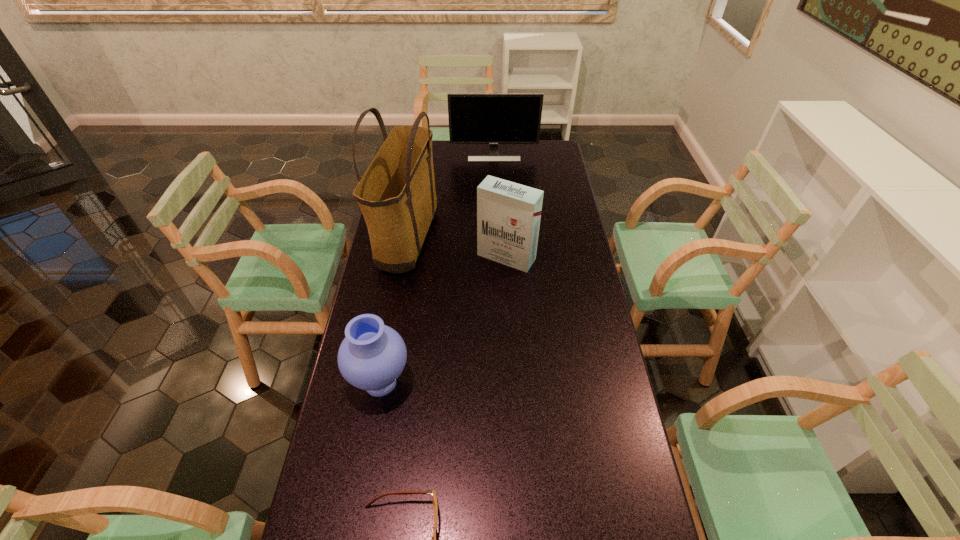
Locate an element on the screen. The width and height of the screenshot is (960, 540). tote bag located at the left edge is located at coordinates (396, 194).

Locate an element on the screen. The image size is (960, 540). vase located at the left edge is located at coordinates (371, 357).

At what (x,y) coordinates should I click in order to perform the action: click on object that is at the right edge. Please return your answer as a coordinate pair (x, y). The height and width of the screenshot is (540, 960). Looking at the image, I should click on (493, 119).

This screenshot has height=540, width=960. Identify the location of object at the far right corner. pos(493,119).

Image resolution: width=960 pixels, height=540 pixels. I want to click on free space at the far edge, so click(x=513, y=153).

The width and height of the screenshot is (960, 540). I want to click on vacant point located between the monitor and the second shortest object, so click(437, 268).

Identify the location of vacant space in between the tallest object and the farthest object. The width and height of the screenshot is (960, 540). (451, 198).

Where is `free point between the tallest object and the cigarette case`? free point between the tallest object and the cigarette case is located at coordinates (457, 249).

Identify the location of vacant space that is in between the fourth farthest object and the cigarette case. This screenshot has height=540, width=960. (444, 320).

At what (x,y) coordinates should I click in order to perform the action: click on vacant space in between the tallest object and the farthest object. Please return your answer as a coordinate pair (x, y). This screenshot has width=960, height=540. Looking at the image, I should click on (451, 198).